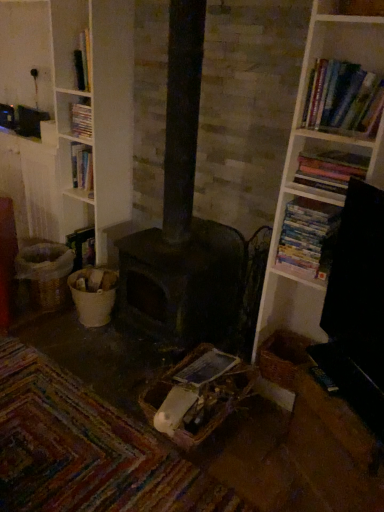
Locate an element on the screen. vacant area on top of woven brown basket at center, the first basket positioned from the front (from a real-world perspective) is located at coordinates (201, 376).